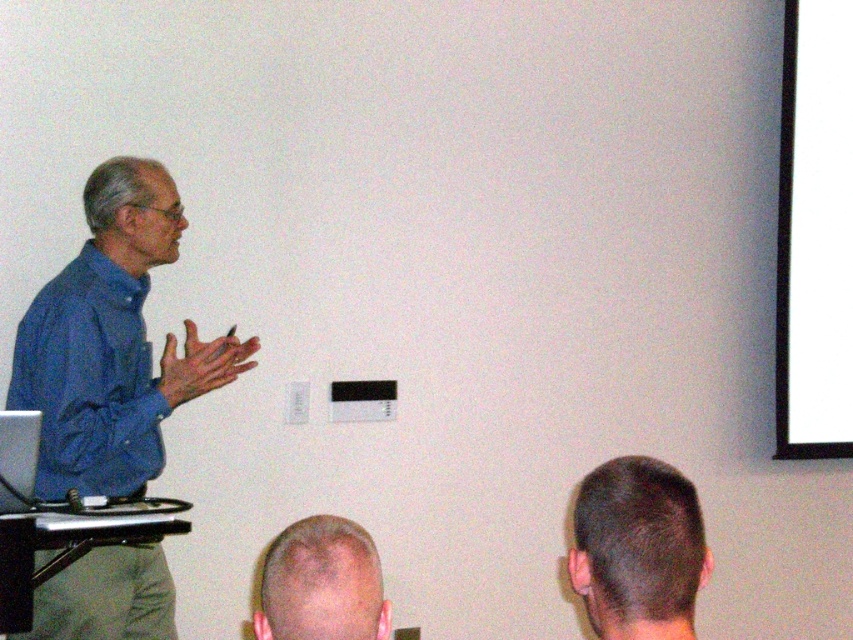
Can you confirm if blue cotton shirt at left is thinner than light brown hair at lower center?

No.

Does blue cotton shirt at left have a greater width compared to light brown hair at lower center?

Indeed, blue cotton shirt at left has a greater width compared to light brown hair at lower center.

The height and width of the screenshot is (640, 853). What are the coordinates of `blue cotton shirt at left` in the screenshot? It's located at (112, 342).

Between white matte projection screen at upper right and light brown hair at lower center, which one is positioned lower?

light brown hair at lower center is below.

Can you confirm if white matte projection screen at upper right is positioned to the right of light brown hair at lower center?

Yes, white matte projection screen at upper right is to the right of light brown hair at lower center.

Locate an element on the screen. The height and width of the screenshot is (640, 853). white matte projection screen at upper right is located at coordinates (814, 234).

Can you confirm if dark brown hair at lower right is shorter than light brown hair at lower center?

No.

Can you confirm if dark brown hair at lower right is smaller than light brown hair at lower center?

Incorrect, dark brown hair at lower right is not smaller in size than light brown hair at lower center.

Locate an element on the screen. The height and width of the screenshot is (640, 853). dark brown hair at lower right is located at coordinates (637, 548).